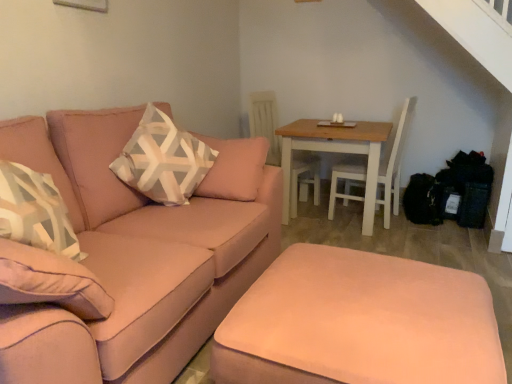
Question: Considering the relative sizes of patterned fabric pillow at center-left and white wood swivel chair at center in the image provided, is patterned fabric pillow at center-left bigger than white wood swivel chair at center?

Choices:
 (A) no
 (B) yes

Answer: (A)

Question: Considering the relative positions of patterned fabric pillow at center-left and white wood swivel chair at center in the image provided, is patterned fabric pillow at center-left to the right of white wood swivel chair at center from the viewer's perspective?

Choices:
 (A) no
 (B) yes

Answer: (A)

Question: Is patterned fabric pillow at center-left turned away from white wood swivel chair at center?

Choices:
 (A) yes
 (B) no

Answer: (B)

Question: From the image's perspective, does patterned fabric pillow at center-left appear higher than white wood swivel chair at center?

Choices:
 (A) yes
 (B) no

Answer: (B)

Question: From a real-world perspective, is patterned fabric pillow at center-left on white wood swivel chair at center?

Choices:
 (A) no
 (B) yes

Answer: (B)

Question: In the image, is light brown wooden table at center right positioned in front of or behind satin pink couch at left?

Choices:
 (A) front
 (B) behind

Answer: (B)

Question: From the image's perspective, is light brown wooden table at center right located above or below satin pink couch at left?

Choices:
 (A) below
 (B) above

Answer: (B)

Question: Is light brown wooden table at center right bigger or smaller than satin pink couch at left?

Choices:
 (A) big
 (B) small

Answer: (B)

Question: Is light brown wooden table at center right situated inside satin pink couch at left or outside?

Choices:
 (A) outside
 (B) inside

Answer: (A)

Question: From a real-world perspective, is white wood swivel chair at center above or below satin pink ottoman at lower center?

Choices:
 (A) above
 (B) below

Answer: (A)

Question: In terms of height, does white wood swivel chair at center look taller or shorter compared to satin pink ottoman at lower center?

Choices:
 (A) short
 (B) tall

Answer: (B)

Question: Considering the positions of white wood swivel chair at center and satin pink ottoman at lower center in the image, is white wood swivel chair at center wider or thinner than satin pink ottoman at lower center?

Choices:
 (A) wide
 (B) thin

Answer: (B)

Question: Would you say white wood swivel chair at center is inside or outside satin pink ottoman at lower center?

Choices:
 (A) outside
 (B) inside

Answer: (A)

Question: Visually, is light brown wooden table at center right positioned to the left or to the right of white wood swivel chair at center?

Choices:
 (A) left
 (B) right

Answer: (B)

Question: In terms of height, does light brown wooden table at center right look taller or shorter compared to white wood swivel chair at center?

Choices:
 (A) tall
 (B) short

Answer: (B)